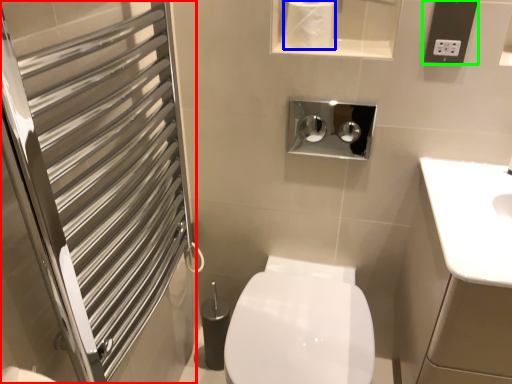
Question: Estimate the real-world distances between objects in this image. Which object is closer to screen door (highlighted by a red box), toilet paper (highlighted by a blue box) or electric outlet (highlighted by a green box)?

Choices:
 (A) toilet paper
 (B) electric outlet

Answer: (A)